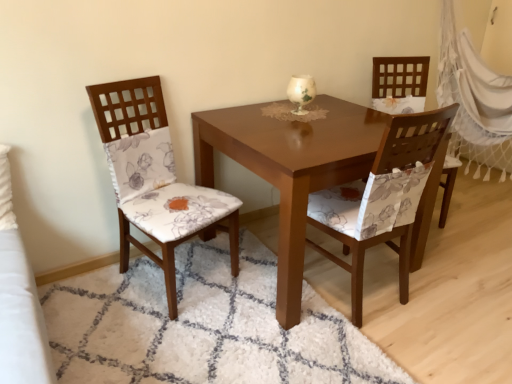
Question: In the image, is white net curtain at right positioned in front of or behind matte floral fabric chair at center, which is the second chair in right-to-left order?

Choices:
 (A) behind
 (B) front

Answer: (A)

Question: Choose the correct answer: Is white net curtain at right inside matte floral fabric chair at center, which is the second chair in right-to-left order, or outside it?

Choices:
 (A) inside
 (B) outside

Answer: (B)

Question: Which is nearer to the white net curtain at right?

Choices:
 (A) white ceramic vase at center
 (B) floral fabric chair at right, which is the 1th chair from right to left
 (C) matte floral fabric chair at center, placed as the 2th chair when sorted from left to right
 (D) white shaggy rug at center
 (E) wooden chair with floral cushion at left, which is counted as the third chair, starting from the right

Answer: (B)

Question: Which is nearer to the white ceramic vase at center?

Choices:
 (A) floral fabric chair at right, placed as the 3th chair when sorted from left to right
 (B) white net curtain at right
 (C) white shaggy rug at center
 (D) matte floral fabric chair at center, placed as the 2th chair when sorted from left to right
 (E) wooden chair with floral cushion at left, positioned as the first chair in left-to-right order

Answer: (D)